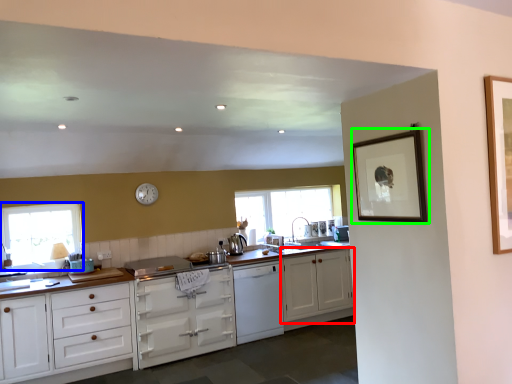
Question: Which is nearer to the cabinetry (highlighted by a red box)? window (highlighted by a blue box) or picture frame (highlighted by a green box).

Choices:
 (A) window
 (B) picture frame

Answer: (B)